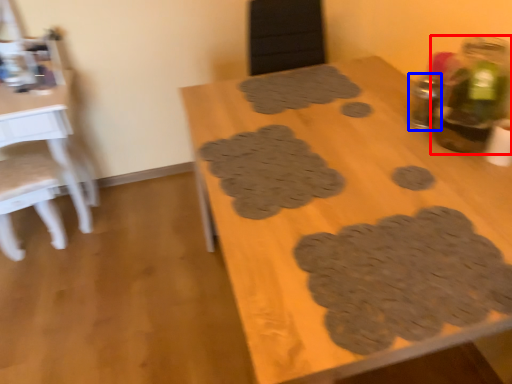
Question: Which object is closer to the camera taking this photo, bottle (highlighted by a red box) or bottle (highlighted by a blue box)?

Choices:
 (A) bottle
 (B) bottle

Answer: (A)